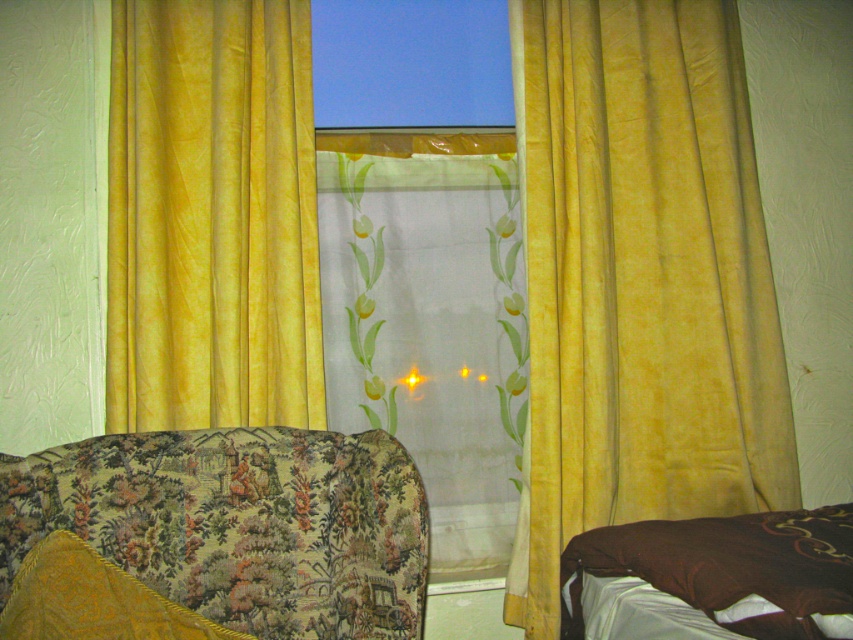
You are arranging a small plant on the windowsill and want to ensure it wons fall off. The yellow velvet curtains at left and the yellow fabric pillow at lower left are nearby. Which object is wider and can provide better support if placed under the plant?

The yellow velvet curtains at left are wider than the yellow fabric pillow at lower left, so placing them under the plant would provide better support to prevent it from falling off the windowsill.

You are arranging a small plant on the windowsill and want to ensure it fits between the transparent fabric at center and the brown soft pillow at lower right. Given their widths, which object requires more horizontal space?

The brown soft pillow at lower right requires more horizontal space because its width is greater than the transparent fabric at center.